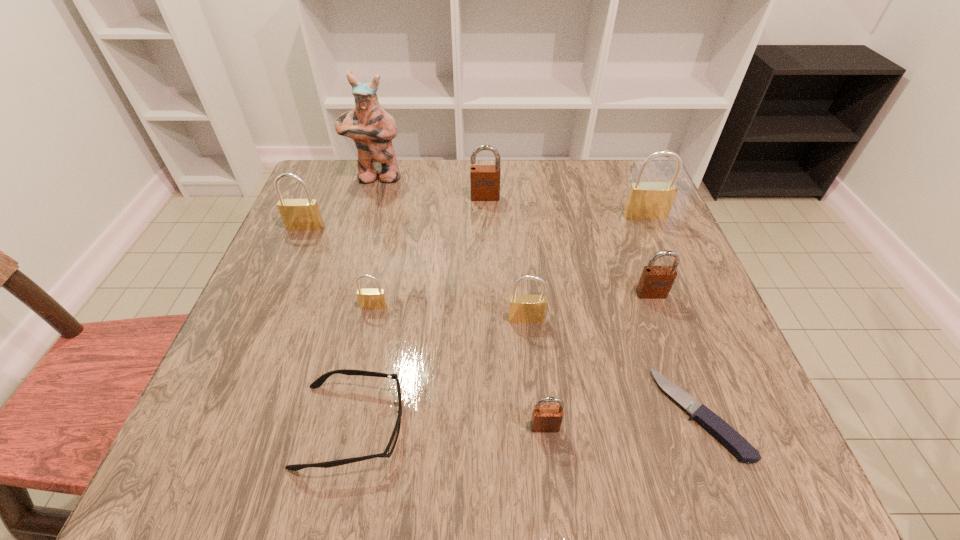
Identify the location of vacant region at the left edge. (301, 289).

This screenshot has height=540, width=960. What are the coordinates of `vacant point at the right edge` in the screenshot? It's located at (641, 262).

Find the location of a particular element. The image size is (960, 540). free region at the far left corner is located at coordinates (349, 206).

The height and width of the screenshot is (540, 960). I want to click on blank space at the far right corner of the desktop, so click(592, 172).

Identify the location of free space at the near right corner. (681, 455).

Identify the location of free space between the second biggest brass padlock and the farthest brown padlock. (396, 212).

Locate an element on the screen. vacant space that's between the nearest brass padlock and the nearest brown padlock is located at coordinates (536, 373).

At what (x,y) coordinates should I click in order to perform the action: click on vacant space that is in between the third biggest brass padlock and the second shortest object. Please return your answer as a coordinate pair (x, y). The height and width of the screenshot is (540, 960). Looking at the image, I should click on (439, 373).

Locate an element on the screen. empty space that is in between the steak knife and the third biggest brass padlock is located at coordinates (612, 366).

Find the location of a particular element. vacant space that is in between the leftmost brass padlock and the ninth tallest object is located at coordinates (328, 327).